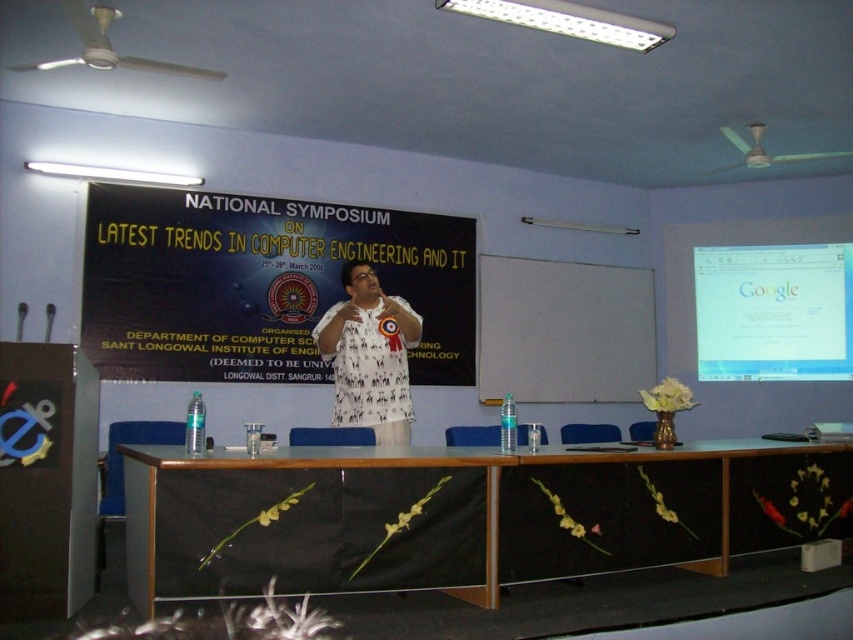
Is point (636, 461) less distant than point (753, 349)?

Yes, point (636, 461) is closer to viewer.

Does black wood table at center have a greater width compared to white glossy projector screen at upper right?

Yes, black wood table at center is wider than white glossy projector screen at upper right.

Locate an element on the screen. The image size is (853, 640). black wood table at center is located at coordinates (445, 515).

Locate an element on the screen. Image resolution: width=853 pixels, height=640 pixels. black wood table at center is located at coordinates (445, 515).

Is black matte banner at center smaller than white printed shirt at center?

No, black matte banner at center is not smaller than white printed shirt at center.

Who is taller, black matte banner at center or white printed shirt at center?

With more height is black matte banner at center.

What do you see at coordinates (260, 284) in the screenshot?
I see `black matte banner at center` at bounding box center [260, 284].

This screenshot has width=853, height=640. Find the location of `black matte banner at center`. black matte banner at center is located at coordinates (260, 284).

How far apart are black wood table at center and white printed shirt at center?

A distance of 77.01 centimeters exists between black wood table at center and white printed shirt at center.

Is black wood table at center above white printed shirt at center?

No.

The height and width of the screenshot is (640, 853). Describe the element at coordinates (445, 515) in the screenshot. I see `black wood table at center` at that location.

In order to click on black wood table at center in this screenshot , I will do `click(445, 515)`.